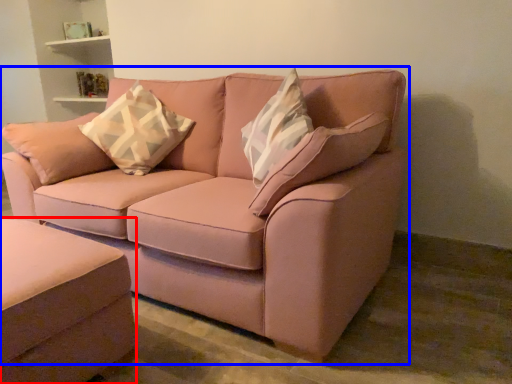
Question: Which of the following is the farthest to the observer, studio couch (highlighted by a red box) or studio couch (highlighted by a blue box)?

Choices:
 (A) studio couch
 (B) studio couch

Answer: (B)